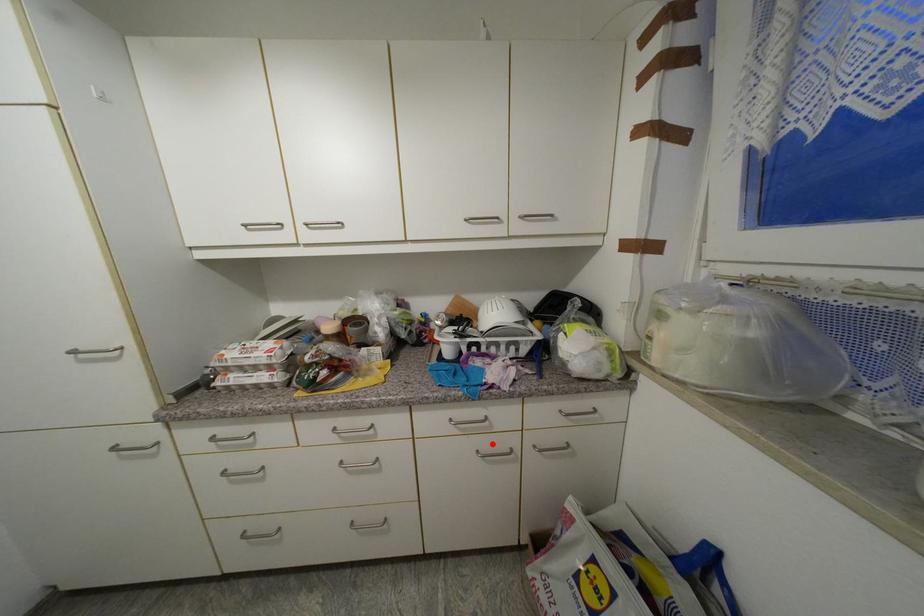
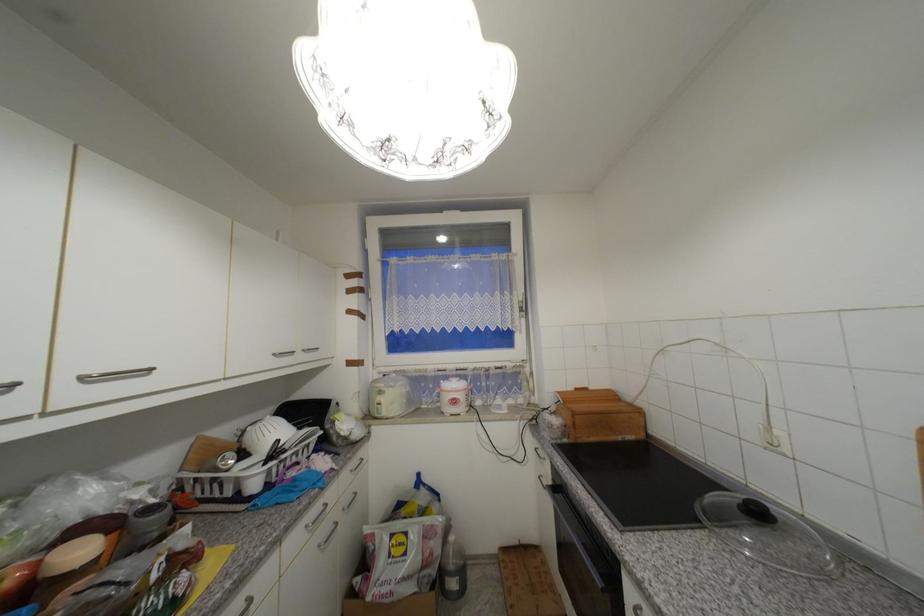
Find the pixel in the second image that matches the highlighted location in the first image.

(330, 531)